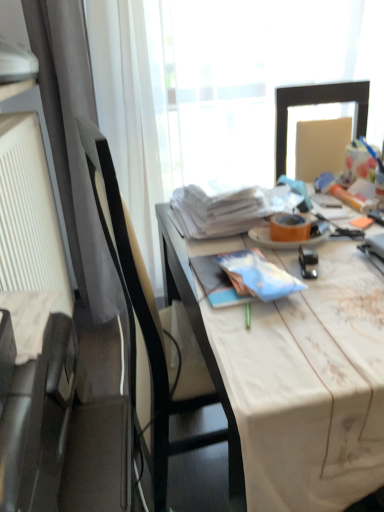
Find the location of a particular element. free space to the left of metallic black stapler at center-right is located at coordinates (235, 250).